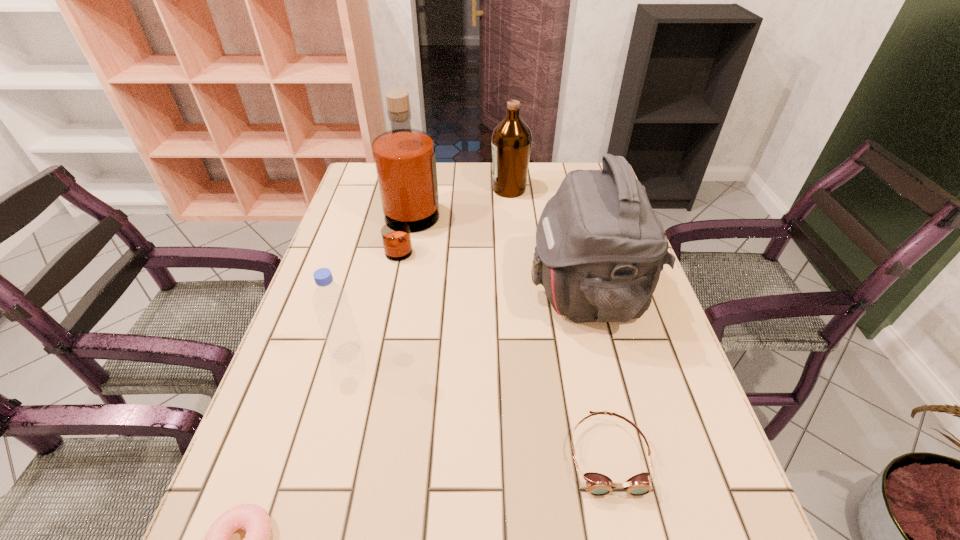
I want to click on vacant point that satisfies the following two spatial constraints: 1. on the open flap of the shoulder bag; 2. on the front side of the bottle, so click(601, 353).

Where is `free space that satisfies the following two spatial constraints: 1. on the front label of the liquor; 2. on the front side of the bottle`? This screenshot has width=960, height=540. free space that satisfies the following two spatial constraints: 1. on the front label of the liquor; 2. on the front side of the bottle is located at coordinates (386, 353).